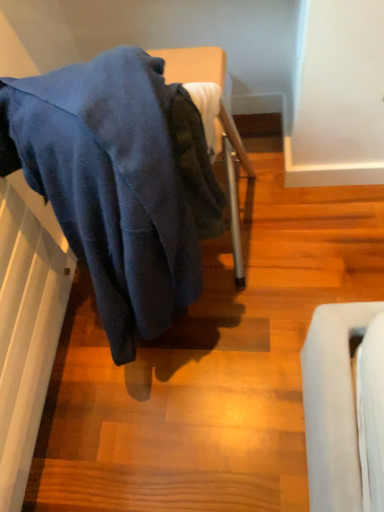
Where is `unoccupied area in front of dark blue fabric at center`? unoccupied area in front of dark blue fabric at center is located at coordinates (182, 432).